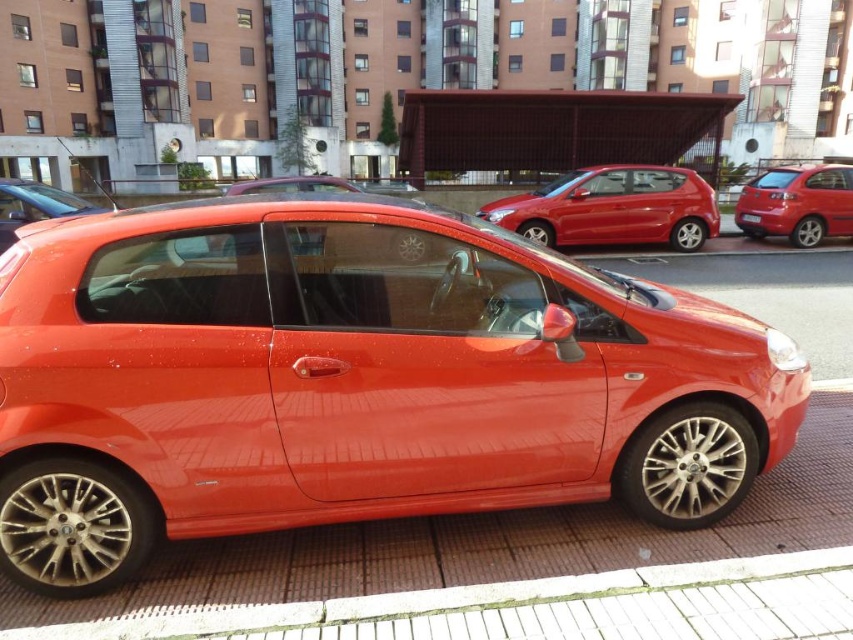
Is brick pavement at center bigger than white brick curb at lower center?

Indeed, brick pavement at center has a larger size compared to white brick curb at lower center.

Where is `brick pavement at center`? brick pavement at center is located at coordinates (473, 545).

Is point (486, 566) positioned in front of point (793, 572)?

No, (486, 566) is behind (793, 572).

Locate an element on the screen. This screenshot has height=640, width=853. brick pavement at center is located at coordinates (473, 545).

Does shiny metallic car at center appear over red plastic license plate at center?

No.

Is point (717, 465) positioned before point (746, 212)?

Yes, it is.

Identify the location of shiny metallic car at center. (352, 380).

How much distance is there between white brick curb at lower center and glossy metallic car at center?

white brick curb at lower center and glossy metallic car at center are 24.55 feet apart.

Which is below, white brick curb at lower center or glossy metallic car at center?

white brick curb at lower center

Is point (642, 602) in front of point (0, 198)?

Yes, point (642, 602) is closer to viewer.

At what (x,y) coordinates should I click in order to perform the action: click on white brick curb at lower center. Please return your answer as a coordinate pair (x, y). Looking at the image, I should click on (540, 605).